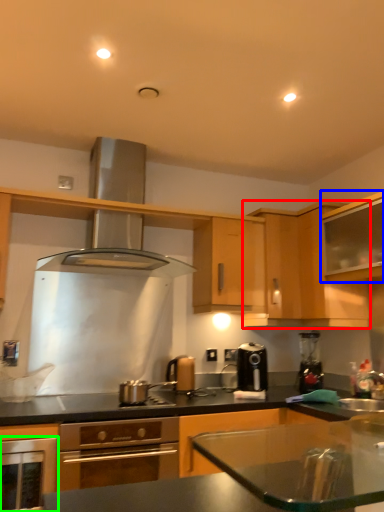
Question: Which is farther away from cabinetry (highlighted by a red box)? cabinetry (highlighted by a blue box) or oven (highlighted by a green box)?

Choices:
 (A) cabinetry
 (B) oven

Answer: (B)